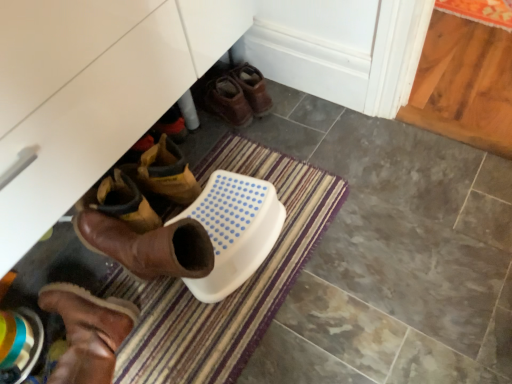
Question: Is brown suede boot at lower left, the second footwear when ordered from right to left, positioned beyond the bounds of striped carpet at lower center?

Choices:
 (A) yes
 (B) no

Answer: (A)

Question: Considering the relative sizes of brown suede boot at lower left, placed as the 1th footwear when sorted from front to back, and striped carpet at lower center in the image provided, is brown suede boot at lower left, placed as the 1th footwear when sorted from front to back, bigger than striped carpet at lower center?

Choices:
 (A) yes
 (B) no

Answer: (B)

Question: Is the depth of brown suede boot at lower left, placed as the 1th footwear when sorted from front to back, less than that of striped carpet at lower center?

Choices:
 (A) no
 (B) yes

Answer: (B)

Question: From a real-world perspective, is brown suede boot at lower left, placed as the 1th footwear when sorted from front to back, physically above striped carpet at lower center?

Choices:
 (A) yes
 (B) no

Answer: (A)

Question: Is brown suede boot at lower left, placed as the 1th footwear when sorted from front to back, surrounding striped carpet at lower center?

Choices:
 (A) no
 (B) yes

Answer: (A)

Question: From the image's perspective, is brown suede boot at lower left, the second footwear when ordered from right to left, located beneath striped carpet at lower center?

Choices:
 (A) yes
 (B) no

Answer: (A)

Question: Can you confirm if striped carpet at lower center is taller than brown suede boot at lower left, which is the second footwear in top-to-bottom order?

Choices:
 (A) yes
 (B) no

Answer: (B)

Question: Is striped carpet at lower center with brown suede boot at lower left, which is the second footwear in top-to-bottom order?

Choices:
 (A) yes
 (B) no

Answer: (B)

Question: Is striped carpet at lower center positioned far away from brown suede boot at lower left, placed as the 1th footwear when sorted from front to back?

Choices:
 (A) no
 (B) yes

Answer: (A)

Question: From the image's perspective, is striped carpet at lower center below brown suede boot at lower left, the second footwear when ordered from right to left?

Choices:
 (A) yes
 (B) no

Answer: (B)

Question: Does striped carpet at lower center have a larger size compared to brown suede boot at lower left, which is the first footwear in left-to-right order?

Choices:
 (A) no
 (B) yes

Answer: (B)

Question: Is striped carpet at lower center facing away from brown suede boot at lower left, which is the 2th footwear in back-to-front order?

Choices:
 (A) yes
 (B) no

Answer: (B)

Question: From a real-world perspective, does brown leather boots at center, acting as the 1th footwear starting from the back, sit lower than brown suede boot at lower left, placed as the 1th footwear when sorted from front to back?

Choices:
 (A) yes
 (B) no

Answer: (A)